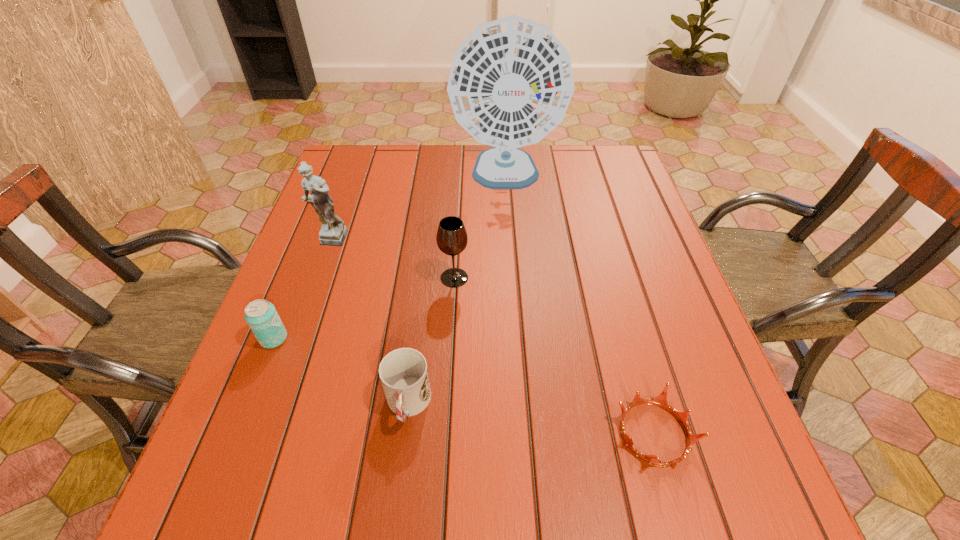
Where is `vacant space situated on the front-facing side of the figurine`? vacant space situated on the front-facing side of the figurine is located at coordinates (276, 390).

In order to click on vacant space located on the back of the fourth shortest object in this screenshot , I will do `click(456, 248)`.

Identify the location of blank space located on the back of the beer can. (306, 256).

The height and width of the screenshot is (540, 960). Identify the location of blank area located 0.060m on the handle side of the cup. (400, 471).

Identify the location of free point located on the left of the shortest object. (564, 434).

The height and width of the screenshot is (540, 960). Find the location of `object positioned at the far edge`. object positioned at the far edge is located at coordinates (511, 81).

Find the location of `figurine located at the left edge`. figurine located at the left edge is located at coordinates (333, 231).

The image size is (960, 540). What are the coordinates of `beer can present at the left edge` in the screenshot? It's located at (261, 316).

This screenshot has height=540, width=960. I want to click on object at the right edge, so click(x=661, y=400).

At what (x,y) coordinates should I click in order to perform the action: click on vacant space at the far edge. Please return your answer as a coordinate pair (x, y). The width and height of the screenshot is (960, 540). Looking at the image, I should click on (569, 149).